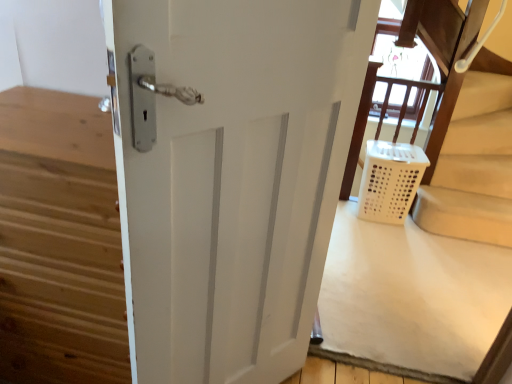
This screenshot has height=384, width=512. Find the location of `white plastic laundry basket at lower right`. white plastic laundry basket at lower right is located at coordinates (469, 144).

Identify the location of white plastic laundry basket at lower right. (390, 181).

At what (x,y) coordinates should I click in order to perform the action: click on laundry basket behind the white plastic laundry basket at lower right. Please return your answer as a coordinate pair (x, y). The image size is (512, 384). Looking at the image, I should click on (390, 181).

Is white plastic laundry basket at lower right aimed at white plastic laundry basket at lower right?

Yes, white plastic laundry basket at lower right is oriented towards white plastic laundry basket at lower right.

From the image's perspective, which is below, white plastic laundry basket at lower right or white plastic laundry basket at lower right?

white plastic laundry basket at lower right.

Considering the sizes of white plastic laundry basket at lower right and white plastic laundry basket at lower right in the image, is white plastic laundry basket at lower right taller or shorter than white plastic laundry basket at lower right?

Considering their sizes, white plastic laundry basket at lower right has less height than white plastic laundry basket at lower right.

Is the position of white plastic laundry basket at lower right more distant than that of white matte door at center?

Yes, white plastic laundry basket at lower right is behind white matte door at center.

Is white plastic laundry basket at lower right turned away from white matte door at center?

No.

From a real-world perspective, relative to white matte door at center, is white plastic laundry basket at lower right vertically above or below?

white plastic laundry basket at lower right is below white matte door at center.

Considering the sizes of objects white plastic laundry basket at lower right and white matte door at center in the image provided, who is thinner, white plastic laundry basket at lower right or white matte door at center?

white plastic laundry basket at lower right is thinner.

Is white matte door at center positioned with its back to white plastic laundry basket at lower right?

white matte door at center does not have its back to white plastic laundry basket at lower right.

Where is `door above the white plastic laundry basket at lower right (from a real-world perspective)`? Image resolution: width=512 pixels, height=384 pixels. door above the white plastic laundry basket at lower right (from a real-world perspective) is located at coordinates (230, 176).

Is white matte door at center wider than white plastic laundry basket at lower right?

Yes.

From a real-world perspective, is white matte door at center positioned above or below white plastic laundry basket at lower right?

In terms of real-world spatial position, white matte door at center is above white plastic laundry basket at lower right.

From a real-world perspective, who is located higher, white plastic laundry basket at lower right or white matte door at center?

In real-world perspective, white matte door at center is above.

Which is more to the right, white plastic laundry basket at lower right or white matte door at center?

Positioned to the right is white plastic laundry basket at lower right.

Which object is closer to the camera taking this photo, white plastic laundry basket at lower right or white matte door at center?

white matte door at center.

Is white plastic laundry basket at lower right to the right of white plastic laundry basket at lower right from the viewer's perspective?

Incorrect, white plastic laundry basket at lower right is not on the right side of white plastic laundry basket at lower right.

What's the angular difference between white plastic laundry basket at lower right and white plastic laundry basket at lower right's facing directions?

They differ by 2.67 degrees in their facing directions.

Measure the distance from white plastic laundry basket at lower right to white plastic laundry basket at lower right.

white plastic laundry basket at lower right is 15.51 inches away from white plastic laundry basket at lower right.

Which is correct: white plastic laundry basket at lower right is inside white plastic laundry basket at lower right, or outside of it?

The correct answer is: outside.

From the image's perspective, is white matte door at center on top of white plastic laundry basket at lower right?

No, from the image's perspective, white matte door at center is not over white plastic laundry basket at lower right.

In the image, is white matte door at center on the left side or the right side of white plastic laundry basket at lower right?

Clearly, white matte door at center is on the left of white plastic laundry basket at lower right in the image.

Which is in front, white matte door at center or white plastic laundry basket at lower right?

Positioned in front is white matte door at center.

Does point (247, 230) come behind point (400, 157)?

No, it is in front of (400, 157).

Locate an element on the screen. This screenshot has height=384, width=512. bunk bed that is on the left side of white plastic laundry basket at lower right is located at coordinates (469, 144).

You are a GUI agent. You are given a task and a screenshot of the screen. Output one action in this format:
    pyautogui.click(x=<x>, y=<y>)
    Task: Click on the bunk bed behind the white matte door at center
    Image resolution: width=512 pixels, height=384 pixels.
    Given the screenshot: What is the action you would take?
    pyautogui.click(x=469, y=144)

Which object lies further to the anchor point white matte door at center, white plastic laundry basket at lower right or white plastic laundry basket at lower right?

Based on the image, white plastic laundry basket at lower right appears to be further to white matte door at center.

Looking at this image, when comparing their distances from white plastic laundry basket at lower right, does white matte door at center or white plastic laundry basket at lower right seem further?

white matte door at center lies further to white plastic laundry basket at lower right than the other object.

When comparing their distances from white plastic laundry basket at lower right, does white plastic laundry basket at lower right or white matte door at center seem further?

white matte door at center is further to white plastic laundry basket at lower right.

Which object lies further to the anchor point white plastic laundry basket at lower right, white matte door at center or white plastic laundry basket at lower right?

Based on the image, white matte door at center appears to be further to white plastic laundry basket at lower right.

Based on their spatial positions, is white plastic laundry basket at lower right or white matte door at center further from white plastic laundry basket at lower right?

The object further to white plastic laundry basket at lower right is white matte door at center.

Considering their positions, is white plastic laundry basket at lower right positioned closer to white matte door at center than white plastic laundry basket at lower right?

white plastic laundry basket at lower right is positioned closer to the anchor white matte door at center.

The width and height of the screenshot is (512, 384). Find the location of `bunk bed located between white matte door at center and white plastic laundry basket at lower right in the depth direction`. bunk bed located between white matte door at center and white plastic laundry basket at lower right in the depth direction is located at coordinates (469, 144).